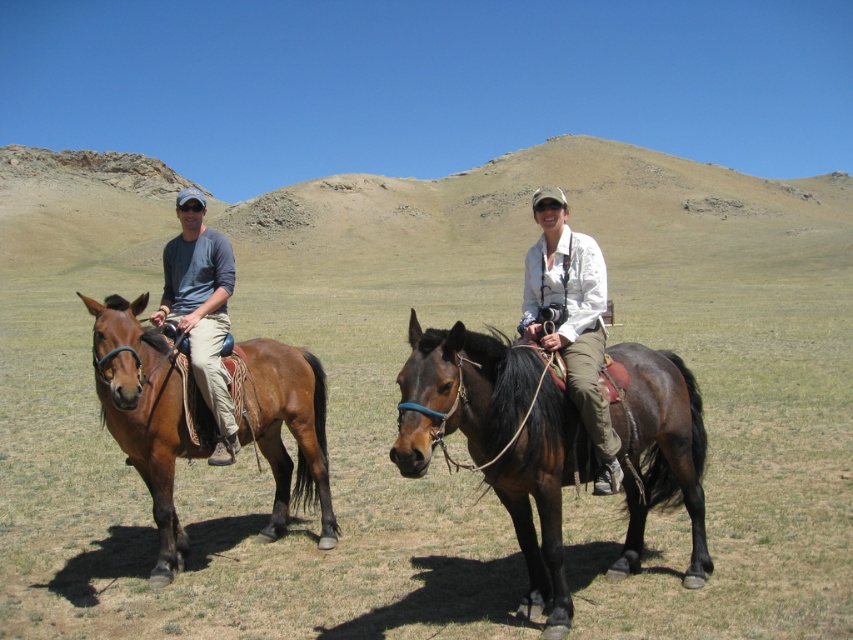
Which is in front, point (595, 337) or point (222, 424)?

Point (595, 337) is in front.

Is the position of white matte jacket at center less distant than that of matte blue shirt at left?

Yes, white matte jacket at center is in front of matte blue shirt at left.

In order to click on white matte jacket at center in this screenshot , I will do `click(572, 320)`.

I want to click on white matte jacket at center, so click(572, 320).

Can you confirm if shiny dark brown horse at center is wider than brown glossy horse at left?

Yes, shiny dark brown horse at center is wider than brown glossy horse at left.

Is point (498, 404) farther from viewer compared to point (154, 477)?

No, it is not.

Does point (618, 385) lie behind point (144, 472)?

No.

Where is `shiny dark brown horse at center`? shiny dark brown horse at center is located at coordinates (498, 442).

Does shiny dark brown horse at center have a greater height compared to white matte jacket at center?

No.

I want to click on shiny dark brown horse at center, so click(x=498, y=442).

Does point (538, 600) come farther from viewer compared to point (598, 436)?

That is True.

You are a GUI agent. You are given a task and a screenshot of the screen. Output one action in this format:
    pyautogui.click(x=<x>, y=<y>)
    Task: Click on the shiny dark brown horse at center
    This screenshot has height=640, width=853.
    Given the screenshot: What is the action you would take?
    pyautogui.click(x=498, y=442)